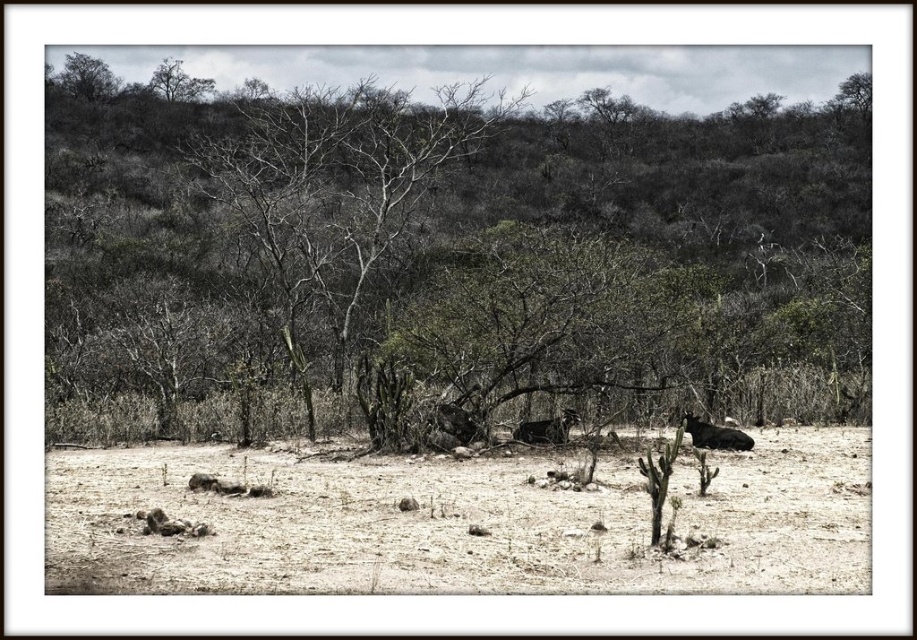
You are standing in the middle of this desert scene. You notice the green leafy tree at center and the brown dirt ground at center. Which one is taller?

The green leafy tree at center is taller than the brown dirt ground at center.

You are standing in the middle of this desert scene. You notice the green leafy tree at center and the brown dirt ground at center. Which object is higher from the ground?

The green leafy tree at center is above the brown dirt ground at center, so the tree is higher.

You are a hiker lost in the desert and notice a gray bark tree at upper left and a dark brown fur at center. Which object is closer to you?

The gray bark tree at upper left is closer to you because the dark brown fur at center is behind it.